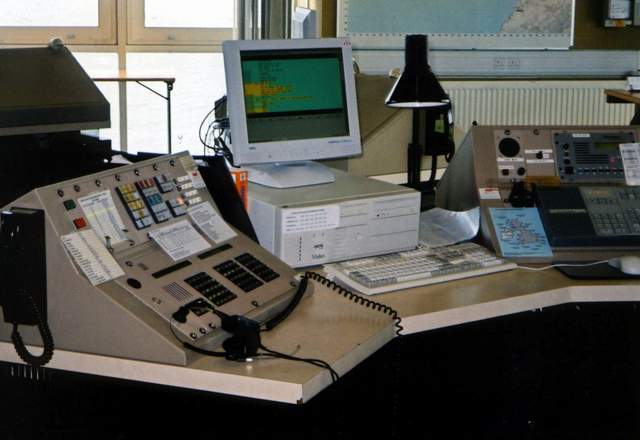
Where is `desk`? The width and height of the screenshot is (640, 440). desk is located at coordinates (459, 302).